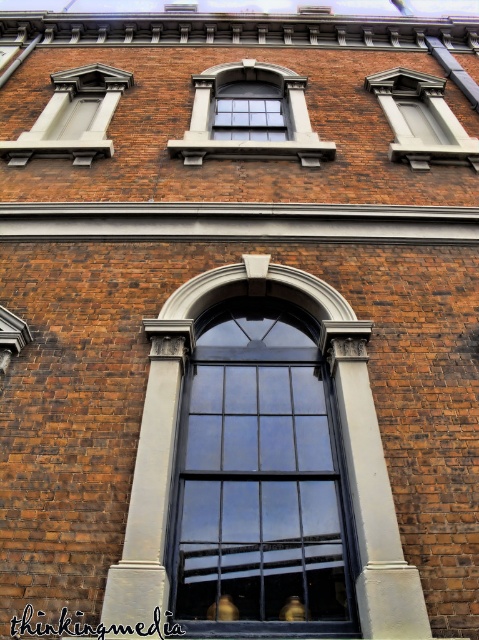
Does matte gray window at upper left have a smaller size compared to matte gray window at upper right?

Incorrect, matte gray window at upper left is not smaller in size than matte gray window at upper right.

Can you confirm if matte gray window at upper left is positioned above matte gray window at upper right?

No, matte gray window at upper left is not above matte gray window at upper right.

What are the coordinates of `matte gray window at upper left` in the screenshot? It's located at (72, 116).

The image size is (479, 640). Identify the location of matte gray window at upper left. (72, 116).

Can you confirm if black glass window at center is positioned above clear glass window at upper center?

No.

Is point (276, 435) farther from viewer compared to point (213, 67)?

No, (276, 435) is in front of (213, 67).

Where is `black glass window at center`? The height and width of the screenshot is (640, 479). black glass window at center is located at coordinates (260, 477).

Is clear glass window at upper center taller than matte gray window at upper right?

Indeed, clear glass window at upper center has a greater height compared to matte gray window at upper right.

The width and height of the screenshot is (479, 640). What do you see at coordinates (250, 140) in the screenshot? I see `clear glass window at upper center` at bounding box center [250, 140].

Between point (194, 141) and point (418, 108), which one is positioned behind?

Positioned behind is point (418, 108).

Where is `clear glass window at upper center`? clear glass window at upper center is located at coordinates (250, 140).